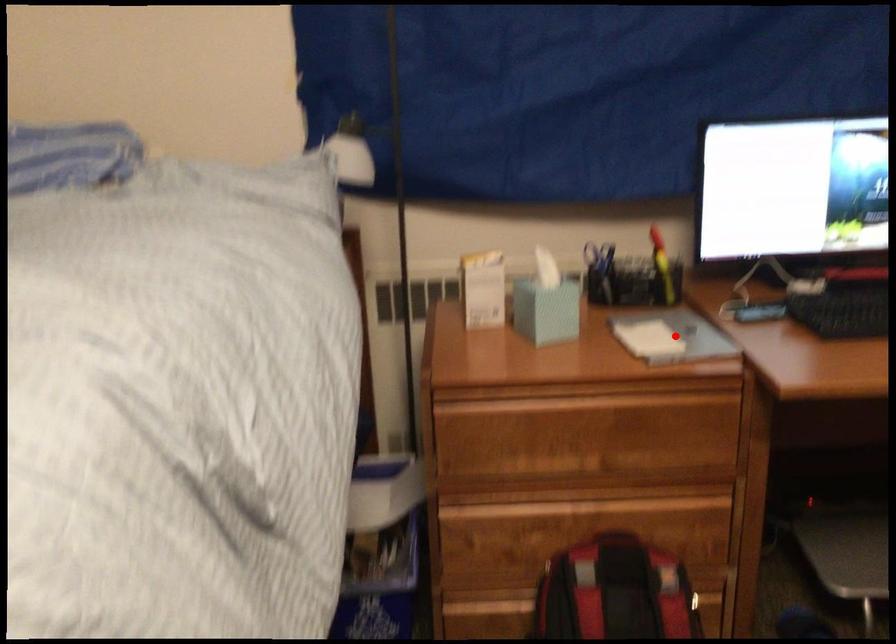
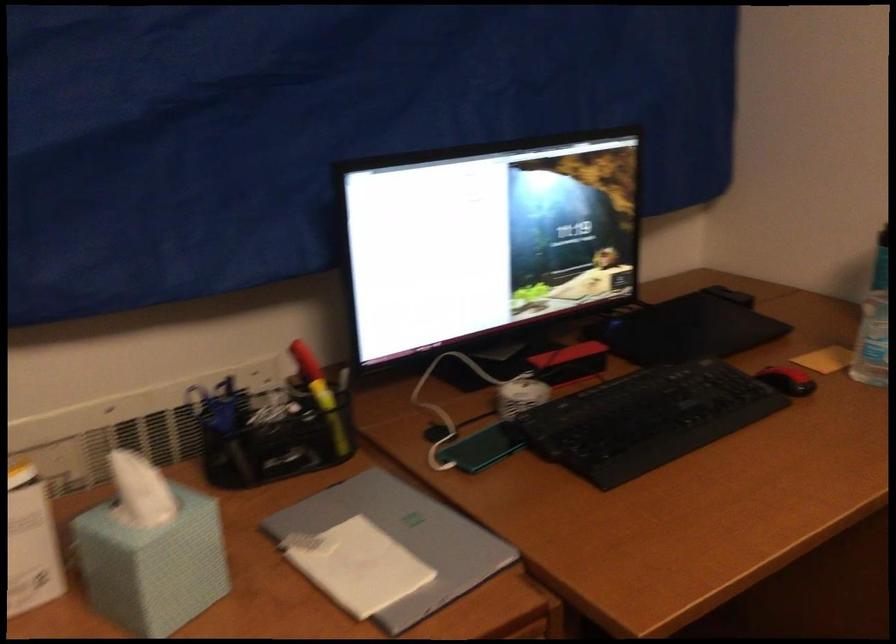
Question: I am providing you with two images of the same scene from different viewpoints. A red point is shown in image1. For the corresponding object point in image2, is it positioned nearer or farther from the camera?

Choices:
 (A) Nearer
 (B) Farther

Answer: (A)